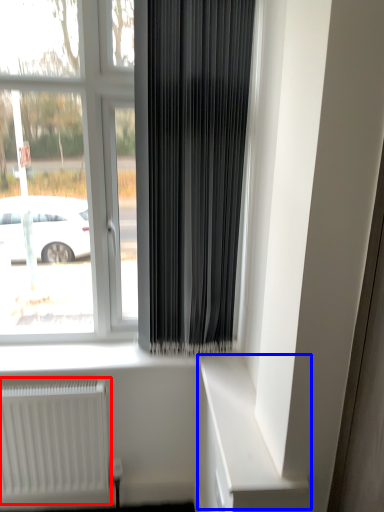
Question: Which point is closer to the camera, radiator (highlighted by a red box) or shelf (highlighted by a blue box)?

Choices:
 (A) radiator
 (B) shelf

Answer: (B)